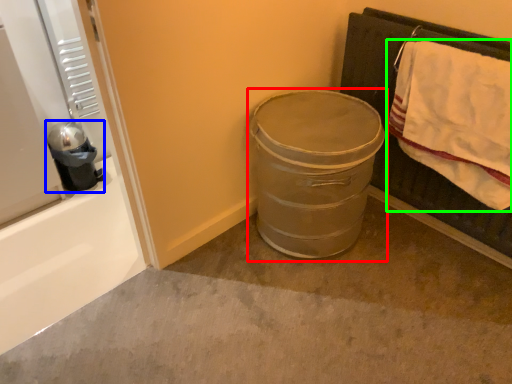
Question: Which object is the farthest from trash bin/can (highlighted by a red box)? Choose among these: appliance (highlighted by a blue box) or bath towel (highlighted by a green box).

Choices:
 (A) appliance
 (B) bath towel

Answer: (A)